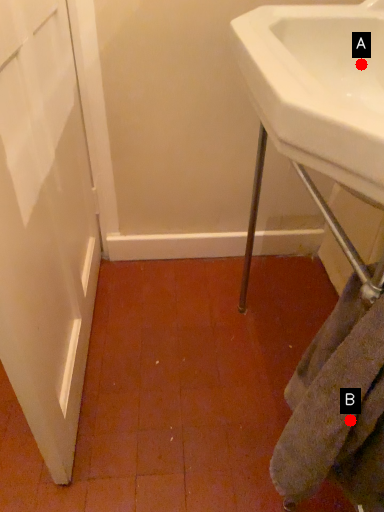
Question: Two points are circled on the image, labeled by A and B beside each circle. Which point is closer to the camera taking this photo?

Choices:
 (A) A is closer
 (B) B is closer

Answer: (B)